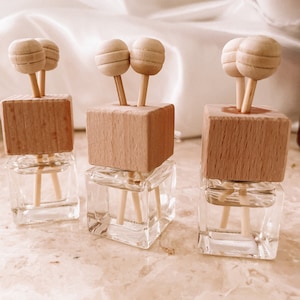
Where is `table`? The height and width of the screenshot is (300, 300). table is located at coordinates (187, 270).